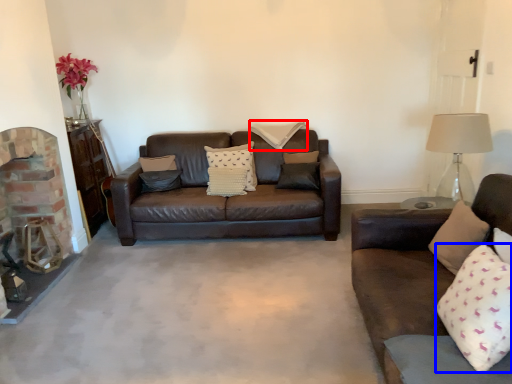
Question: Which point is closer to the camera, pillow (highlighted by a red box) or pillow (highlighted by a blue box)?

Choices:
 (A) pillow
 (B) pillow

Answer: (B)